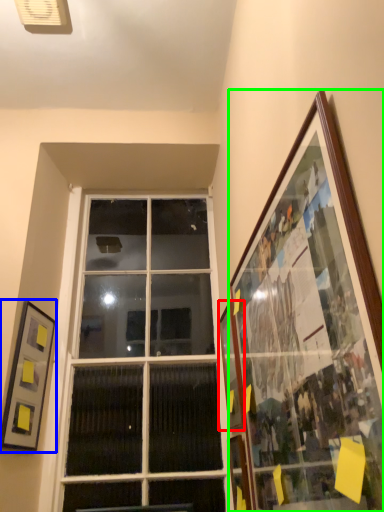
Question: Which is nearer to the picture frame (highlighted by a red box)? picture frame (highlighted by a blue box) or picture frame (highlighted by a green box).

Choices:
 (A) picture frame
 (B) picture frame

Answer: (B)